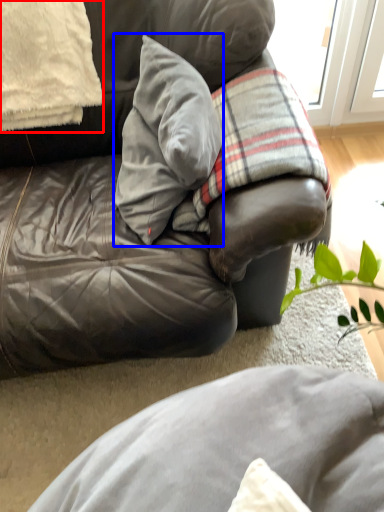
Question: Which object appears farthest to the camera in this image, pillow (highlighted by a red box) or pillow (highlighted by a blue box)?

Choices:
 (A) pillow
 (B) pillow

Answer: (A)